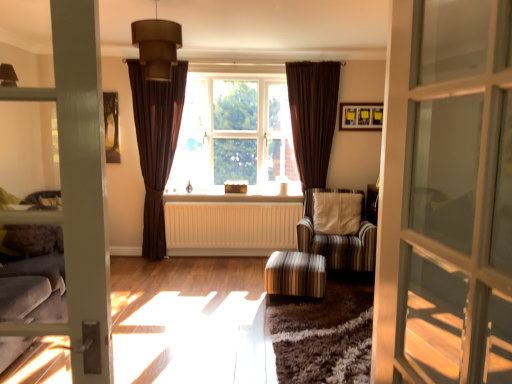
This screenshot has height=384, width=512. Find the location of `free space in front of striped fabric stool at lower center`. free space in front of striped fabric stool at lower center is located at coordinates (298, 317).